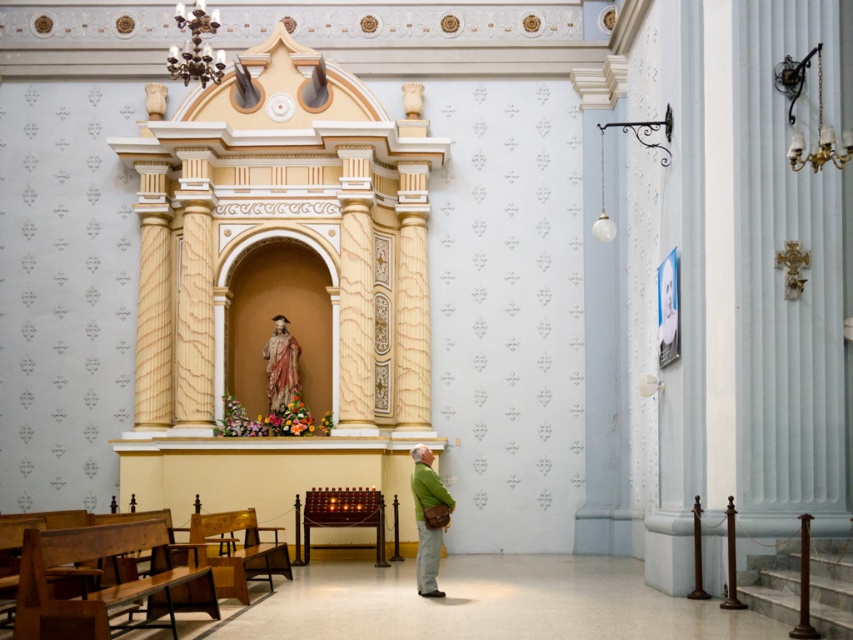
You are attending a church service and need to sit down. You see a wooden polished bench at lower left and a green fabric jacket at center. Which seating option is closer to you?

The wooden polished bench at lower left is closer to the viewer than the green fabric jacket at center, so the bench is the closer seating option.

You are an interior designer planning to place a new decorative item in the church. You have a choice between placing it on the wooden polished bench at lower left or near the polychrome wood statue at center. Considering their sizes, which location offers more space for the item?

The wooden polished bench at lower left is larger in size than the polychrome wood statue at center, so placing the decorative item on the wooden polished bench at lower left would provide more space.

From the picture: You are an interior designer planning to place a new decorative item between the green fabric jacket at center and the polychrome wood statue at center. Given their widths, which object should you place the item closer to to ensure it doesn,t get crowded?

The green fabric jacket at center has a smaller width compared to the polychrome wood statue at center. To avoid crowding, place the new decorative item closer to the green fabric jacket at center since it takes up less space.